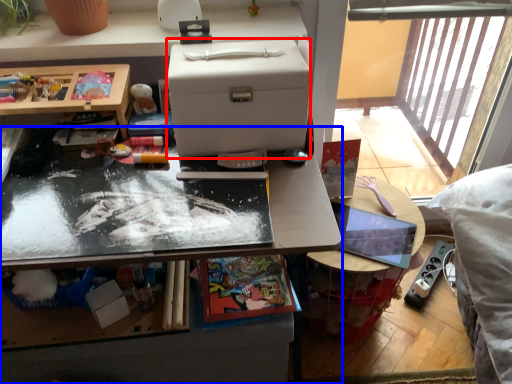
Question: Which object is closer to the camera taking this photo, box (highlighted by a red box) or desk (highlighted by a blue box)?

Choices:
 (A) box
 (B) desk

Answer: (A)